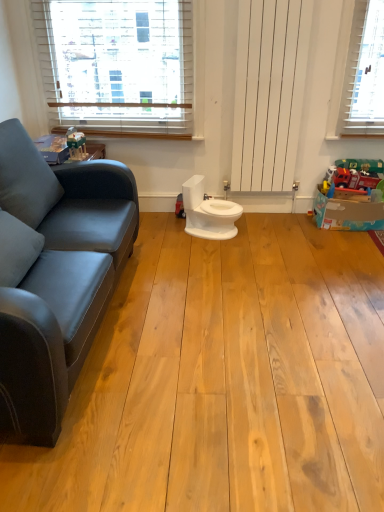
The height and width of the screenshot is (512, 384). What are the coordinates of `free spot in front of white glossy toilet at center` in the screenshot? It's located at (199, 251).